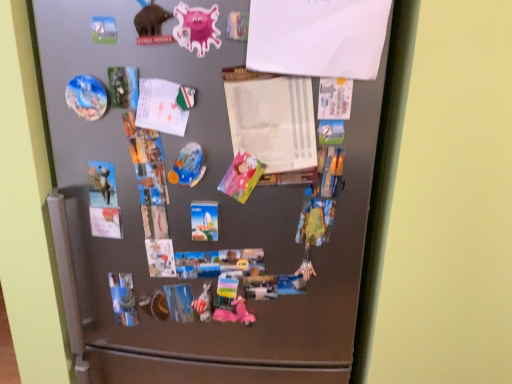
Question: Considering the positions of satin silver fridge at center and white paper at upper center, acting as the 2th paper starting from the bottom, in the image, is satin silver fridge at center taller or shorter than white paper at upper center, acting as the 2th paper starting from the bottom,?

Choices:
 (A) tall
 (B) short

Answer: (A)

Question: Based on their sizes in the image, would you say satin silver fridge at center is bigger or smaller than white paper at upper center, the first paper positioned from the front?

Choices:
 (A) small
 (B) big

Answer: (B)

Question: Estimate the real-world distances between objects in this image. Which object is farther from the white paper at upper center, the first paper positioned from the front?

Choices:
 (A) white paper at center, placed as the second paper when sorted from front to back
 (B) pastel paper art at center, the third art in the top-to-bottom sequence
 (C) shiny metallic plate at center, the second art from the left
 (D) metallic silver statue at center, marked as the third art in a left-to-right arrangement
 (E) satin silver fridge at center

Answer: (D)

Question: Based on their relative distances, which object is nearer to the shiny metallic plate at center, the second art from the left?

Choices:
 (A) white paper at upper center, acting as the 2th paper starting from the bottom
 (B) matte plastic magnet at upper left, placed as the first art when sorted from left to right
 (C) white paper at center, the first paper ordered from the bottom
 (D) pastel paper art at center, the 1th art when ordered from right to left
 (E) satin silver fridge at center

Answer: (D)